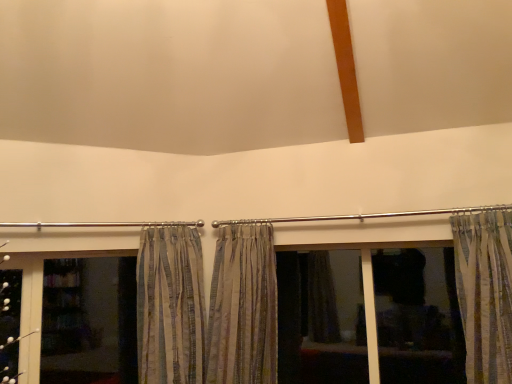
Question: Is dark fabric curtain at center wider or thinner than striped fabric curtain at center, the first curtain in the left-to-right sequence?

Choices:
 (A) wide
 (B) thin

Answer: (B)

Question: From a real-world perspective, is dark fabric curtain at center positioned above or below striped fabric curtain at center, the first curtain in the left-to-right sequence?

Choices:
 (A) below
 (B) above

Answer: (A)

Question: Estimate the real-world distances between objects in this image. Which object is farther from the striped fabric curtain at center, the first curtain in the left-to-right sequence?

Choices:
 (A) striped fabric curtain at center, the second curtain in the left-to-right sequence
 (B) transparent glass screen door at lower left
 (C) striped fabric curtain at right, the first curtain from the right
 (D) dark fabric curtain at center

Answer: (C)

Question: Considering the real-world distances, which object is closest to the striped fabric curtain at center, the first curtain in the left-to-right sequence?

Choices:
 (A) dark fabric curtain at center
 (B) striped fabric curtain at right, which ranks as the third curtain in left-to-right order
 (C) transparent glass screen door at lower left
 (D) striped fabric curtain at center, the second curtain in the right-to-left sequence

Answer: (D)